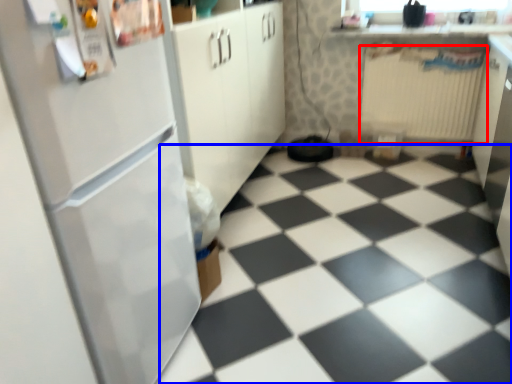
Question: Which object is closer to the camera taking this photo, radiator (highlighted by a red box) or tile (highlighted by a blue box)?

Choices:
 (A) radiator
 (B) tile

Answer: (B)